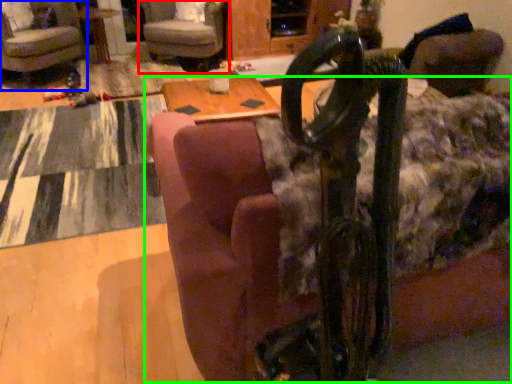
Question: Estimate the real-world distances between objects in this image. Which object is closer to chair (highlighted by a red box), chair (highlighted by a blue box) or couch (highlighted by a green box)?

Choices:
 (A) chair
 (B) couch

Answer: (A)